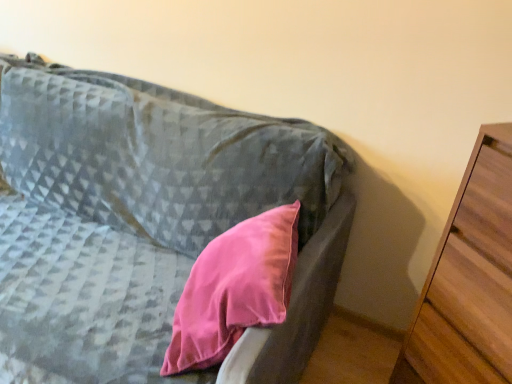
Question: Considering the positions of matte gray couch at center and wooden chest of drawers at right in the image, is matte gray couch at center wider or thinner than wooden chest of drawers at right?

Choices:
 (A) wide
 (B) thin

Answer: (A)

Question: Would you say matte gray couch at center is inside or outside wooden chest of drawers at right?

Choices:
 (A) outside
 (B) inside

Answer: (A)

Question: Visually, is matte gray couch at center positioned to the left or to the right of wooden chest of drawers at right?

Choices:
 (A) left
 (B) right

Answer: (A)

Question: Considering the positions of point (473, 375) and point (47, 274), is point (473, 375) closer or farther from the camera than point (47, 274)?

Choices:
 (A) farther
 (B) closer

Answer: (B)

Question: In terms of height, does wooden chest of drawers at right look taller or shorter compared to matte gray couch at center?

Choices:
 (A) tall
 (B) short

Answer: (A)

Question: From the image's perspective, is wooden chest of drawers at right positioned above or below matte gray couch at center?

Choices:
 (A) above
 (B) below

Answer: (B)

Question: Is wooden chest of drawers at right wider or thinner than matte gray couch at center?

Choices:
 (A) wide
 (B) thin

Answer: (B)